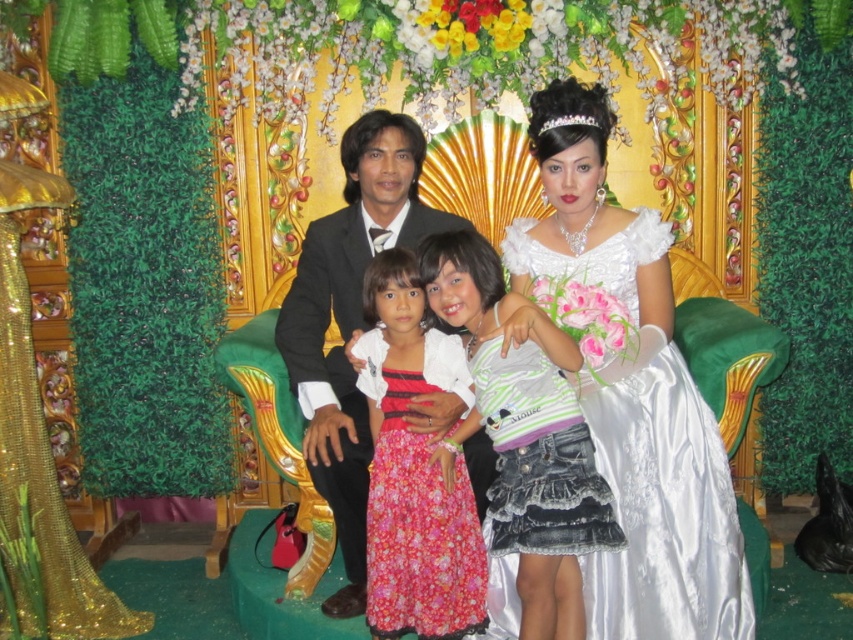
Can you confirm if shiny black suit at center is positioned to the left of floral cotton dress at center?

Yes, shiny black suit at center is to the left of floral cotton dress at center.

Who is taller, shiny black suit at center or floral cotton dress at center?

With more height is shiny black suit at center.

Locate an element on the screen. This screenshot has width=853, height=640. shiny black suit at center is located at coordinates (350, 321).

The width and height of the screenshot is (853, 640). In order to click on shiny black suit at center in this screenshot , I will do `click(350, 321)`.

Who is taller, striped jersey at center or denim skirt at center?

striped jersey at center is taller.

Which is below, striped jersey at center or denim skirt at center?

denim skirt at center

Find the location of a particular element. The image size is (853, 640). striped jersey at center is located at coordinates (523, 433).

Find the location of a particular element. striped jersey at center is located at coordinates (523, 433).

Does point (593, 522) come in front of point (345, 486)?

Yes, it is in front of point (345, 486).

Locate an element on the screen. Image resolution: width=853 pixels, height=640 pixels. striped jersey at center is located at coordinates (523, 433).